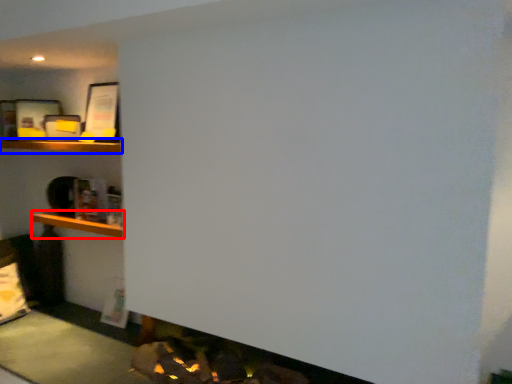
Question: Which point is further to the camera, cabinet (highlighted by a red box) or shelf (highlighted by a blue box)?

Choices:
 (A) cabinet
 (B) shelf

Answer: (A)